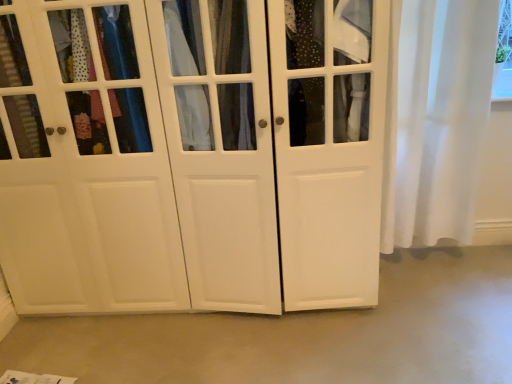
Question: From a real-world perspective, relative to white matte cabinet at center, is smooth concrete floor at center vertically above or below?

Choices:
 (A) below
 (B) above

Answer: (A)

Question: Considering their positions, is smooth concrete floor at center located in front of or behind white matte cabinet at center?

Choices:
 (A) behind
 (B) front

Answer: (A)

Question: Which of these objects is positioned closest to the smooth concrete floor at center?

Choices:
 (A) white sheer curtain at right
 (B) white matte cabinet at center

Answer: (B)

Question: Which of these objects is positioned farthest from the white matte cabinet at center?

Choices:
 (A) white sheer curtain at right
 (B) smooth concrete floor at center

Answer: (A)